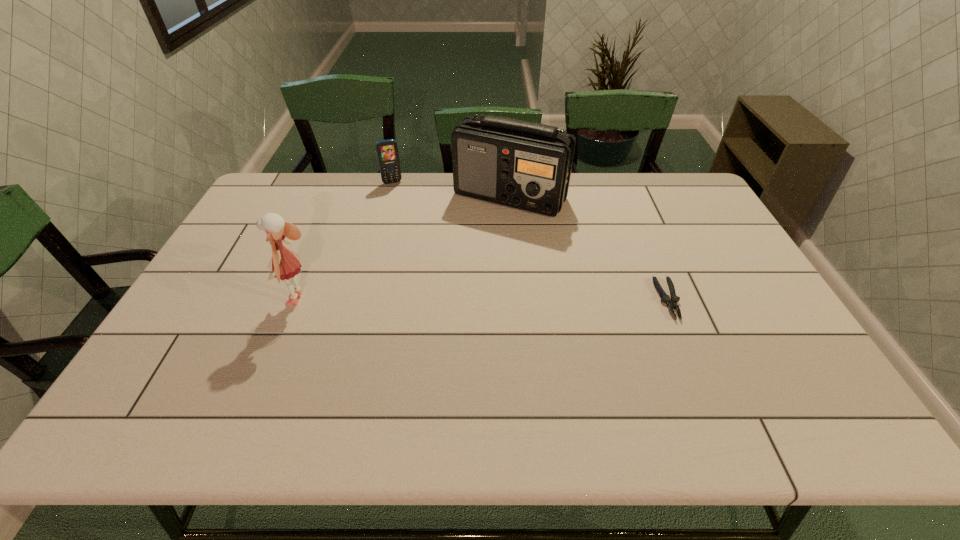
At what (x,y) coordinates should I click in order to perform the action: click on doll. Please return your answer as a coordinate pair (x, y). The height and width of the screenshot is (540, 960). Looking at the image, I should click on click(x=285, y=264).

Where is `the shortest object`? the shortest object is located at coordinates (671, 302).

At what (x,y) coordinates should I click in order to perform the action: click on pliers. Please return your answer as a coordinate pair (x, y). The image size is (960, 540). Looking at the image, I should click on (671, 302).

Image resolution: width=960 pixels, height=540 pixels. I want to click on the second object from left to right, so click(x=387, y=151).

Where is `cellular telephone`? Image resolution: width=960 pixels, height=540 pixels. cellular telephone is located at coordinates (387, 151).

What are the coordinates of `radio receiver` in the screenshot? It's located at (525, 165).

Locate an element on the screen. This screenshot has width=960, height=540. blank space located on the front-facing side of the doll is located at coordinates (195, 300).

Where is `vacant space located on the front-facing side of the doll`? The image size is (960, 540). vacant space located on the front-facing side of the doll is located at coordinates (206, 300).

You are a GUI agent. You are given a task and a screenshot of the screen. Output one action in this format:
    pyautogui.click(x=<x>, y=<y>)
    Task: Click on the vacant space located on the front-facing side of the doll
    Image resolution: width=960 pixels, height=540 pixels.
    Given the screenshot: What is the action you would take?
    [232, 300]

Find the location of `free space located 0.090m at the gripping part of the shortest object`. free space located 0.090m at the gripping part of the shortest object is located at coordinates (689, 350).